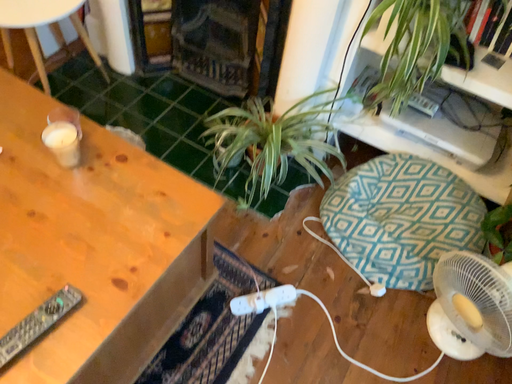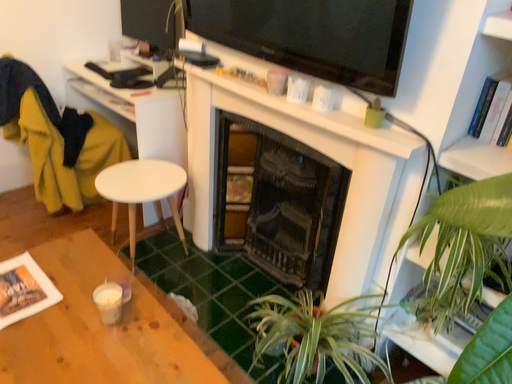
Question: How did the camera likely rotate when shooting the video?

Choices:
 (A) rotated downward
 (B) rotated upward

Answer: (B)